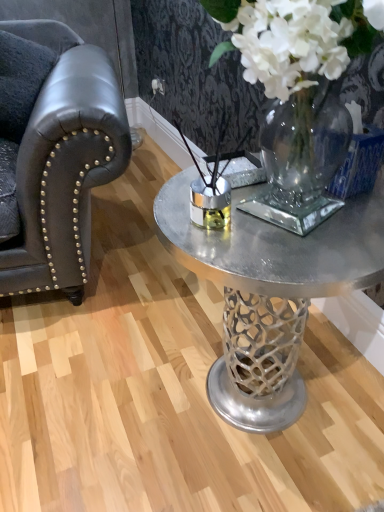
Question: Does matte black leather armchair at left have a greater width compared to dark leather armrest at left?

Choices:
 (A) yes
 (B) no

Answer: (A)

Question: Considering the relative positions of matte black leather armchair at left and dark leather armrest at left in the image provided, is matte black leather armchair at left in front of dark leather armrest at left?

Choices:
 (A) yes
 (B) no

Answer: (A)

Question: Does matte black leather armchair at left appear on the right side of dark leather armrest at left?

Choices:
 (A) no
 (B) yes

Answer: (B)

Question: From a real-world perspective, does matte black leather armchair at left sit lower than dark leather armrest at left?

Choices:
 (A) yes
 (B) no

Answer: (A)

Question: Can you confirm if matte black leather armchair at left is positioned to the left of dark leather armrest at left?

Choices:
 (A) yes
 (B) no

Answer: (B)

Question: Does point (294, 143) appear closer or farther from the camera than point (56, 266)?

Choices:
 (A) farther
 (B) closer

Answer: (B)

Question: Considering the positions of clear glass vase at center and matte black leather armchair at left in the image, is clear glass vase at center wider or thinner than matte black leather armchair at left?

Choices:
 (A) wide
 (B) thin

Answer: (B)

Question: Which is correct: clear glass vase at center is inside matte black leather armchair at left, or outside of it?

Choices:
 (A) outside
 (B) inside

Answer: (A)

Question: From a real-world perspective, is clear glass vase at center above or below matte black leather armchair at left?

Choices:
 (A) above
 (B) below

Answer: (A)

Question: From a real-world perspective, is dark leather armrest at left positioned above or below clear glass vase at center?

Choices:
 (A) above
 (B) below

Answer: (B)

Question: Relative to clear glass vase at center, is dark leather armrest at left in front or behind?

Choices:
 (A) front
 (B) behind

Answer: (B)

Question: Is dark leather armrest at left situated inside clear glass vase at center or outside?

Choices:
 (A) inside
 (B) outside

Answer: (B)

Question: Is dark leather armrest at left bigger or smaller than clear glass vase at center?

Choices:
 (A) big
 (B) small

Answer: (B)

Question: From the image's perspective, relative to metallic silver coffee table at center, is clear glass vase at center above or below?

Choices:
 (A) above
 (B) below

Answer: (B)

Question: Does point (304, 224) appear closer or farther from the camera than point (297, 237)?

Choices:
 (A) closer
 (B) farther

Answer: (B)